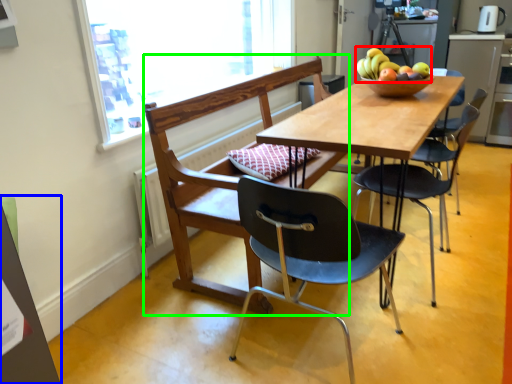
Question: Which is nearer to the fruit (highlighted by a red box)? bulletin board (highlighted by a blue box) or chair (highlighted by a green box).

Choices:
 (A) bulletin board
 (B) chair

Answer: (B)